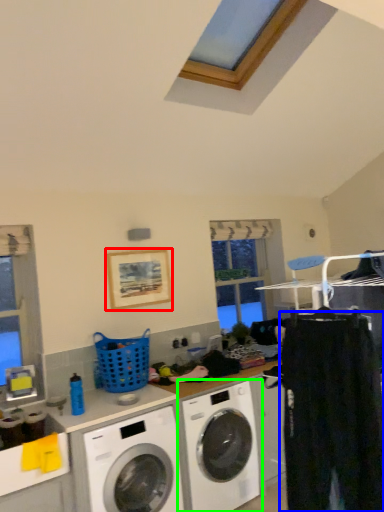
Question: Based on their relative distances, which object is farther from picture frame (highlighted by a red box)? Choose from clothing (highlighted by a blue box) and washing machine (highlighted by a green box).

Choices:
 (A) clothing
 (B) washing machine

Answer: (A)